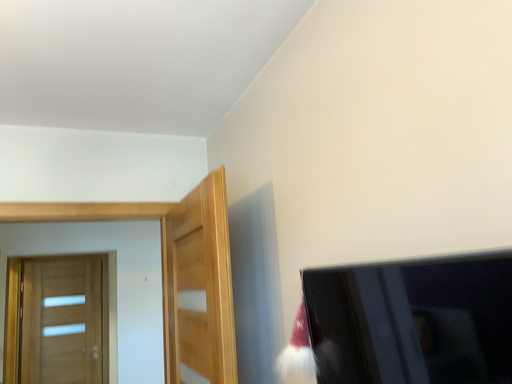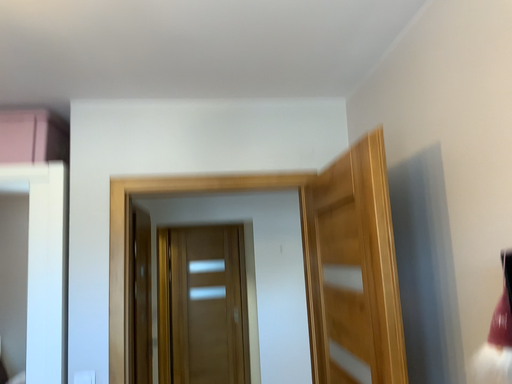
Question: How did the camera likely rotate when shooting the video?

Choices:
 (A) rotated left
 (B) rotated right

Answer: (A)